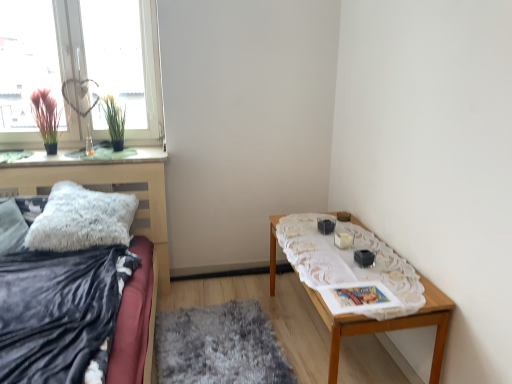
The image size is (512, 384). What do you see at coordinates (114, 121) in the screenshot? I see `green grass-like plant at upper left, positioned as the 1th plant in right-to-left order` at bounding box center [114, 121].

Measure the distance between fuzzy gray rug at center and camera.

fuzzy gray rug at center is 6.57 feet away from camera.

Image resolution: width=512 pixels, height=384 pixels. What are the coordinates of `green grass-like plant at upper left, the 2th plant when ordered from left to right` in the screenshot? It's located at (114, 121).

How distant is green grass-like plant at upper left, the 2th plant when ordered from left to right, from silky pink plant at window, which is the 2th plant in right-to-left order?

The distance of green grass-like plant at upper left, the 2th plant when ordered from left to right, from silky pink plant at window, which is the 2th plant in right-to-left order, is 34.76 centimeters.

Considering the relative sizes of green grass-like plant at upper left, positioned as the 1th plant in right-to-left order, and silky pink plant at window, which is the 2th plant in right-to-left order, in the image provided, is green grass-like plant at upper left, positioned as the 1th plant in right-to-left order, taller than silky pink plant at window, which is the 2th plant in right-to-left order,?

No.

Is point (121, 150) positioned behind point (56, 128)?

Yes.

In terms of size, does green grass-like plant at upper left, the 2th plant when ordered from left to right, appear bigger or smaller than silky pink plant at window, which is the 2th plant in right-to-left order?

Clearly, green grass-like plant at upper left, the 2th plant when ordered from left to right, is smaller in size than silky pink plant at window, which is the 2th plant in right-to-left order.

Considering the positions of objects green grass-like plant at upper left, the 2th plant when ordered from left to right, and white fluffy pillow at left in the image provided, who is behind, green grass-like plant at upper left, the 2th plant when ordered from left to right, or white fluffy pillow at left?

green grass-like plant at upper left, the 2th plant when ordered from left to right, is more distant.

From the image's perspective, which one is positioned lower, green grass-like plant at upper left, the 2th plant when ordered from left to right, or white fluffy pillow at left?

white fluffy pillow at left, from the image's perspective.

Can you confirm if green grass-like plant at upper left, the 2th plant when ordered from left to right, is taller than white fluffy pillow at left?

Correct, green grass-like plant at upper left, the 2th plant when ordered from left to right, is much taller as white fluffy pillow at left.

Which plant is the 2nd one when counting from the back of the white fluffy pillow at left? Please provide its 2D coordinates.

[(114, 121)]

From a real-world perspective, which is physically below, velvet dark blue blanket at lower left, the 2th blanket in the right-to-left sequence, or white lace tablecloth at right, the 1th blanket positioned from the right?

In real-world perspective, white lace tablecloth at right, the 1th blanket positioned from the right, is lower.

From the image's perspective, is velvet dark blue blanket at lower left, the 2th blanket in the right-to-left sequence, below white lace tablecloth at right, the 2th blanket when ordered from left to right?

Yes.

Who is smaller, velvet dark blue blanket at lower left, the 2th blanket in the right-to-left sequence, or white lace tablecloth at right, the 1th blanket positioned from the right?

With smaller size is white lace tablecloth at right, the 1th blanket positioned from the right.

Is fuzzy gray rug at center wider or thinner than velvet dark blue blanket at lower left, the 2th blanket in the right-to-left sequence?

fuzzy gray rug at center is thinner than velvet dark blue blanket at lower left, the 2th blanket in the right-to-left sequence.

Is fuzzy gray rug at center aimed at velvet dark blue blanket at lower left, the 2th blanket in the right-to-left sequence?

No.

Which of these two, fuzzy gray rug at center or velvet dark blue blanket at lower left, the first blanket viewed from the left, stands shorter?

With less height is fuzzy gray rug at center.

Which of these two, fuzzy gray rug at center or velvet dark blue blanket at lower left, the first blanket viewed from the left, is smaller?

With smaller size is fuzzy gray rug at center.

Between point (61, 227) and point (83, 129), which one is positioned in front?

The point (61, 227) is closer.

Which object is more forward, white fluffy pillow at left or transparent glass window at upper left?

white fluffy pillow at left is closer to the camera.

From the image's perspective, which is below, white fluffy pillow at left or transparent glass window at upper left?

white fluffy pillow at left is shown below in the image.

Could you tell me if white fluffy pillow at left is facing transparent glass window at upper left?

No, white fluffy pillow at left does not turn towards transparent glass window at upper left.

Is white lace tablecloth at right, the 2th blanket when ordered from left to right, spatially inside silky pink plant at window, which is the 2th plant in right-to-left order, or outside of it?

white lace tablecloth at right, the 2th blanket when ordered from left to right, exists outside the volume of silky pink plant at window, which is the 2th plant in right-to-left order.

How distant is white lace tablecloth at right, the 2th blanket when ordered from left to right, from silky pink plant at window, which is the 2th plant in right-to-left order?

5.85 feet.

From a real-world perspective, does white lace tablecloth at right, the 1th blanket positioned from the right, sit lower than silky pink plant at window, arranged as the first plant when viewed from the left?

Yes, from a real-world perspective, white lace tablecloth at right, the 1th blanket positioned from the right, is beneath silky pink plant at window, arranged as the first plant when viewed from the left.

Which blanket is the 1st one when counting from the front of the silky pink plant at window, which is the 2th plant in right-to-left order? Please provide its 2D coordinates.

[(348, 262)]

From their relative heights in the image, would you say transparent glass window at upper left is taller or shorter than green grass-like plant at upper left, positioned as the 1th plant in right-to-left order?

transparent glass window at upper left is taller than green grass-like plant at upper left, positioned as the 1th plant in right-to-left order.

Can you tell me how much transparent glass window at upper left and green grass-like plant at upper left, positioned as the 1th plant in right-to-left order, differ in facing direction?

1.55 degrees.

Does point (158, 54) lie behind point (110, 95)?

No, (158, 54) is in front of (110, 95).

Can you confirm if transparent glass window at upper left is positioned to the right of green grass-like plant at upper left, positioned as the 1th plant in right-to-left order?

No, transparent glass window at upper left is not to the right of green grass-like plant at upper left, positioned as the 1th plant in right-to-left order.

The height and width of the screenshot is (384, 512). What are the coordinates of `plant below the green grass-like plant at upper left, positioned as the 1th plant in right-to-left order (from the image's perspective)` in the screenshot? It's located at (46, 118).

In the image, there is a green grass-like plant at upper left, positioned as the 1th plant in right-to-left order. Find the location of `throw pillow below it (from a real-world perspective)`. throw pillow below it (from a real-world perspective) is located at coordinates (81, 219).

Considering their positions, is green grass-like plant at upper left, the 2th plant when ordered from left to right, positioned closer to wooden table at right than velvet dark blue blanket at lower left, the first blanket viewed from the left?

velvet dark blue blanket at lower left, the first blanket viewed from the left, is closer to wooden table at right.

Based on their spatial positions, is green grass-like plant at upper left, positioned as the 1th plant in right-to-left order, or white fluffy pillow at left further from transparent glass window at upper left?

Among the two, white fluffy pillow at left is located further to transparent glass window at upper left.

Based on their spatial positions, is green grass-like plant at upper left, positioned as the 1th plant in right-to-left order, or white lace tablecloth at right, the 2th blanket when ordered from left to right, closer to fuzzy gray rug at center?

white lace tablecloth at right, the 2th blanket when ordered from left to right.

Based on their spatial positions, is transparent glass window at upper left or green grass-like plant at upper left, the 2th plant when ordered from left to right, closer to white lace tablecloth at right, the 1th blanket positioned from the right?

green grass-like plant at upper left, the 2th plant when ordered from left to right.

Looking at this image, when comparing their distances from velvet dark blue blanket at lower left, the first blanket viewed from the left, does wooden table at right or green grass-like plant at upper left, the 2th plant when ordered from left to right, seem closer?

Among the two, wooden table at right is located nearer to velvet dark blue blanket at lower left, the first blanket viewed from the left.

From the image, which object appears to be farther from white fluffy pillow at left, silky pink plant at window, which is the 2th plant in right-to-left order, or velvet dark blue blanket at lower left, the first blanket viewed from the left?

Based on the image, silky pink plant at window, which is the 2th plant in right-to-left order, appears to be further to white fluffy pillow at left.

Based on their spatial positions, is white fluffy pillow at left or white lace tablecloth at right, the 1th blanket positioned from the right, closer to wooden table at right?

Based on the image, white lace tablecloth at right, the 1th blanket positioned from the right, appears to be nearer to wooden table at right.

Estimate the real-world distances between objects in this image. Which object is closer to fuzzy gray rug at center, wooden table at right or transparent glass window at upper left?

Based on the image, wooden table at right appears to be nearer to fuzzy gray rug at center.

The width and height of the screenshot is (512, 384). In order to click on plant between green grass-like plant at upper left, positioned as the 1th plant in right-to-left order, and white fluffy pillow at left, in the vertical direction in this screenshot , I will do `click(46, 118)`.

Locate an element on the screen. The height and width of the screenshot is (384, 512). table between green grass-like plant at upper left, positioned as the 1th plant in right-to-left order, and fuzzy gray rug at center in the up-down direction is located at coordinates (388, 325).

Locate an element on the screen. mat located between velvet dark blue blanket at lower left, the 2th blanket in the right-to-left sequence, and white fluffy pillow at left in the depth direction is located at coordinates (219, 346).

This screenshot has width=512, height=384. Identify the location of blanket between transparent glass window at upper left and white lace tablecloth at right, the 1th blanket positioned from the right, from left to right. (59, 312).